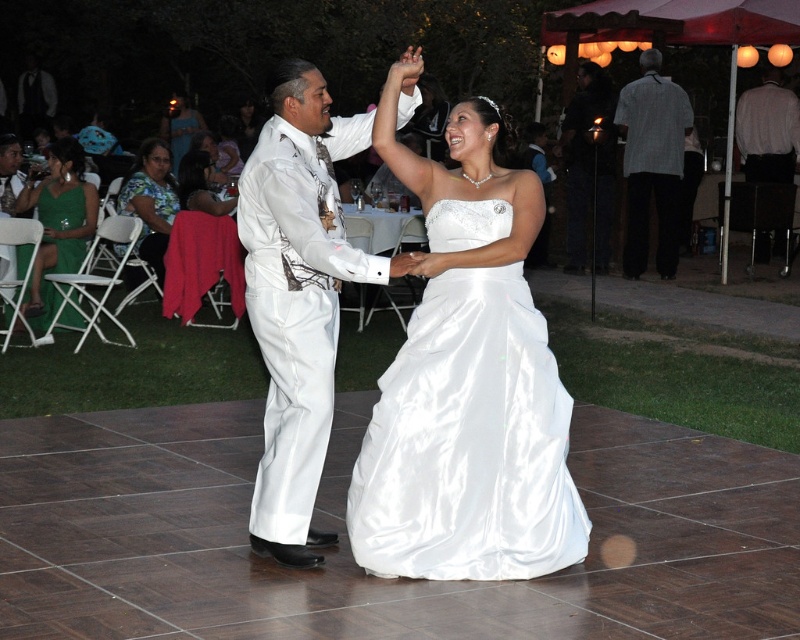
Between white satin suit at center and matte black suit at right, which one is positioned lower?

white satin suit at center

In the scene shown: Can you confirm if white satin suit at center is positioned above matte black suit at right?

Incorrect, white satin suit at center is not positioned above matte black suit at right.

Who is more forward, (393,266) or (582,266)?

Point (393,266) is in front.

You are a GUI agent. You are given a task and a screenshot of the screen. Output one action in this format:
    pyautogui.click(x=<x>, y=<y>)
    Task: Click on the white satin suit at center
    
    Given the screenshot: What is the action you would take?
    pyautogui.click(x=298, y=298)

Is green satin dress at left behind green satin dress at lower left?

No, it is in front of green satin dress at lower left.

Which is behind, point (42, 195) or point (81, 252)?

The point (42, 195) is behind.

Where is `green satin dress at left`? This screenshot has width=800, height=640. green satin dress at left is located at coordinates (58, 225).

Which of these two, satin dress at center or matte black suit at right, stands shorter?

Standing shorter between the two is satin dress at center.

Between point (552, 369) and point (601, 234), which one is positioned behind?

The point (601, 234) is behind.

Where is `satin dress at center`? satin dress at center is located at coordinates (468, 381).